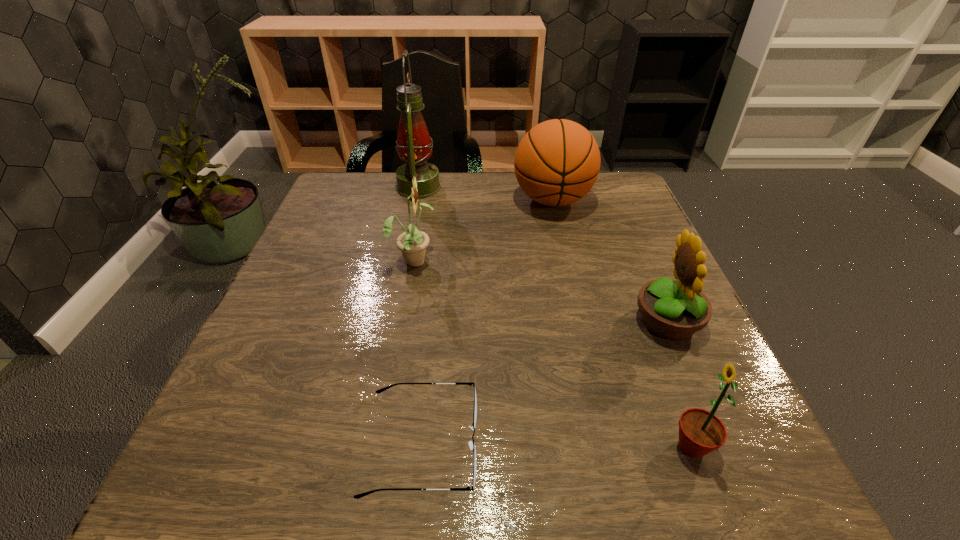
In the image, there is a desktop. At what (x,y) coordinates should I click in order to perform the action: click on vacant space at the far right corner. Please return your answer as a coordinate pair (x, y). Looking at the image, I should click on (596, 200).

Find the location of a particular element. This screenshot has height=540, width=960. vacant space in between the nearest sunflower and the basketball is located at coordinates (x=622, y=323).

Identify the location of free space between the second nearest sunflower and the fourth nearest object. (540, 291).

This screenshot has height=540, width=960. Find the location of `unoccupied position between the leftmost sunflower and the shortest object`. unoccupied position between the leftmost sunflower and the shortest object is located at coordinates (418, 353).

The image size is (960, 540). Find the location of `free space between the basketball and the second nearest sunflower`. free space between the basketball and the second nearest sunflower is located at coordinates (610, 261).

You are a GUI agent. You are given a task and a screenshot of the screen. Output one action in this format:
    pyautogui.click(x=<x>, y=<y>)
    Task: Click on the free point between the shortest object and the tallest object
    Image resolution: width=960 pixels, height=540 pixels.
    Given the screenshot: What is the action you would take?
    pyautogui.click(x=420, y=316)

You are a GUI agent. You are given a task and a screenshot of the screen. Output one action in this format:
    pyautogui.click(x=<x>, y=<y>)
    Task: Click on the free area in between the nearest sunflower and the farthest sunflower
    This screenshot has width=960, height=540.
    Given the screenshot: What is the action you would take?
    pyautogui.click(x=553, y=353)

Where is `vacant space that is in between the oil lamp and the basketball`? This screenshot has height=540, width=960. vacant space that is in between the oil lamp and the basketball is located at coordinates (486, 194).

Locate an element on the screen. The height and width of the screenshot is (540, 960). vacant point located between the leftmost sunflower and the nearest sunflower is located at coordinates (553, 353).

Identify the location of unoccupied position between the nearest sunflower and the basketball. The image size is (960, 540). (622, 323).